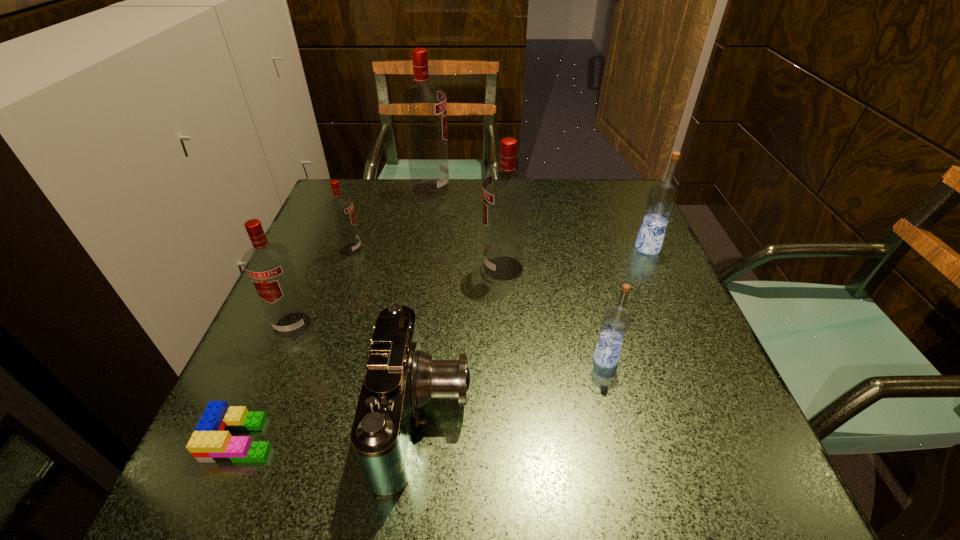
You are a GUI agent. You are given a task and a screenshot of the screen. Output one action in this format:
    pyautogui.click(x=<x>, y=<y>)
    Task: Click on the vacant space located on the front label of the fifth farthest object
    
    Given the screenshot: What is the action you would take?
    pyautogui.click(x=230, y=473)

Identify the location of vacant space located on the front label of the smallest red vodka. [466, 249].

Where is `vacant area located on the back of the seventh object from left to right`? The image size is (960, 540). vacant area located on the back of the seventh object from left to right is located at coordinates (580, 262).

Identify the location of vacant space located 0.310m on the front-facing side of the second shortest object. (664, 417).

In order to click on vacant area located on the right of the Lego in this screenshot , I will do `click(398, 438)`.

Where is `object located at the far edge`? This screenshot has width=960, height=540. object located at the far edge is located at coordinates (423, 106).

Identify the location of camcorder at the near edge. The image size is (960, 540). (400, 379).

Locate an element on the screen. Lego situated at the near edge is located at coordinates (211, 441).

At what (x,y) coordinates should I click in order to perform the action: click on Lego that is at the left edge. Please return your answer as a coordinate pair (x, y). Looking at the image, I should click on coord(211,441).

Identify the location of object located in the right edge section of the desktop. (662, 199).